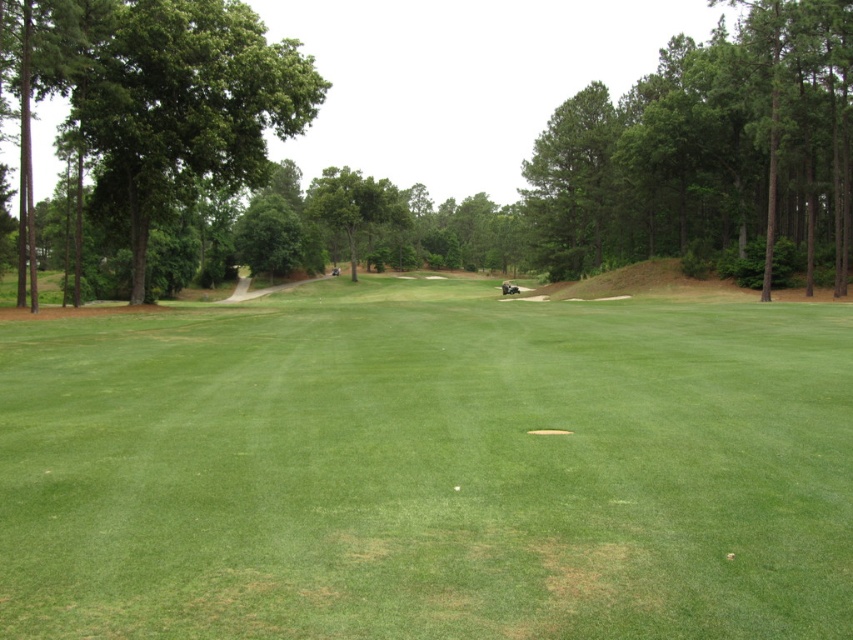
Is green leafy tree at right bigger than green leafy tree at left?

Correct, green leafy tree at right is larger in size than green leafy tree at left.

Between green leafy tree at right and green leafy tree at left, which one has more height?

With more height is green leafy tree at right.

You are a GUI agent. You are given a task and a screenshot of the screen. Output one action in this format:
    pyautogui.click(x=<x>, y=<y>)
    Task: Click on the green leafy tree at right
    
    Given the screenshot: What is the action you would take?
    pyautogui.click(x=706, y=148)

Locate an element on the screen. The height and width of the screenshot is (640, 853). green leafy tree at right is located at coordinates (706, 148).

Can you confirm if green grassy field at center is positioned below green leafy tree at center?

Indeed, green grassy field at center is positioned under green leafy tree at center.

Between point (352, 582) and point (33, 74), which one is positioned in front?

Point (352, 582) is in front.

The width and height of the screenshot is (853, 640). I want to click on green grassy field at center, so click(x=428, y=468).

Between green grassy field at center and green leafy tree at right, which one is positioned higher?

green leafy tree at right

In the scene shown: Between green grassy field at center and green leafy tree at right, which one appears on the right side from the viewer's perspective?

green leafy tree at right is more to the right.

What do you see at coordinates (428, 468) in the screenshot?
I see `green grassy field at center` at bounding box center [428, 468].

Locate an element on the screen. green grassy field at center is located at coordinates (428, 468).